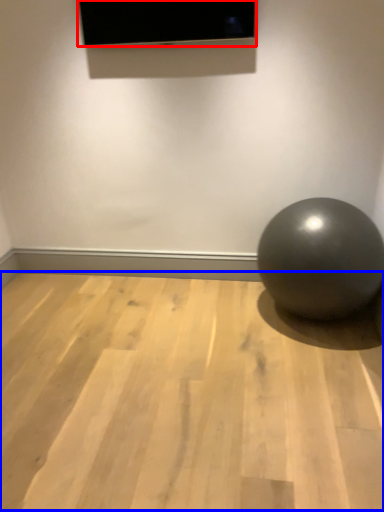
Question: Which point is closer to the camera, projection screen (highlighted by a red box) or surface (highlighted by a blue box)?

Choices:
 (A) projection screen
 (B) surface

Answer: (B)